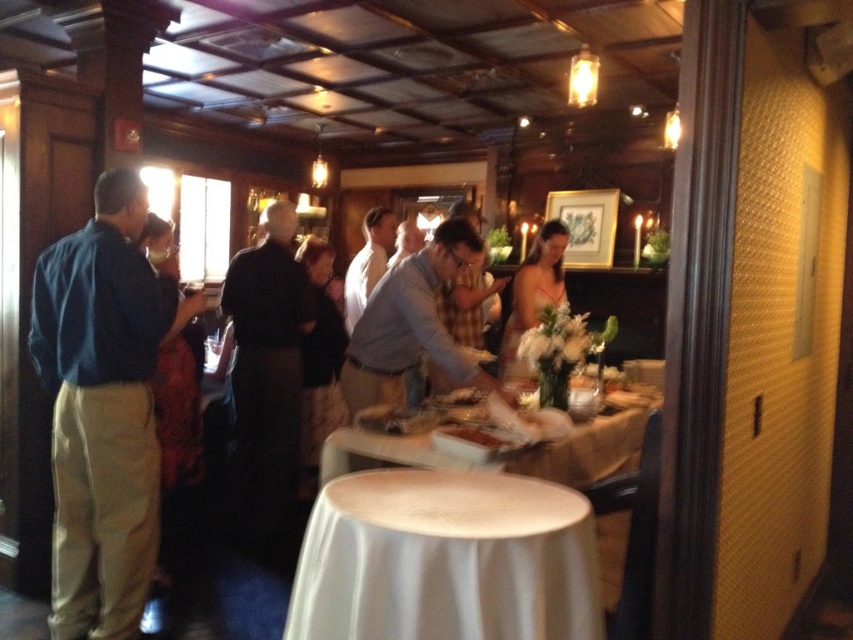
You are a guest at this event and want to sit down at the table. However, you notice that the white cloth table at center is currently occupied by the matte orange dress at center. Can you estimate whether the table has enough space for you to sit without displacing the dress?

The white cloth table at center is wider than the matte orange dress at center, so there is likely enough space for you to sit without displacing the dress.

You are at a party and want to get some food from the white cloth table at center. There is a person in a blue shirt at left blocking your path. Can you walk around them to reach the table?

The blue shirt at left is to the left of white cloth table at center, so you can walk around to the right side of the blue shirt at left to reach the white cloth table at center.